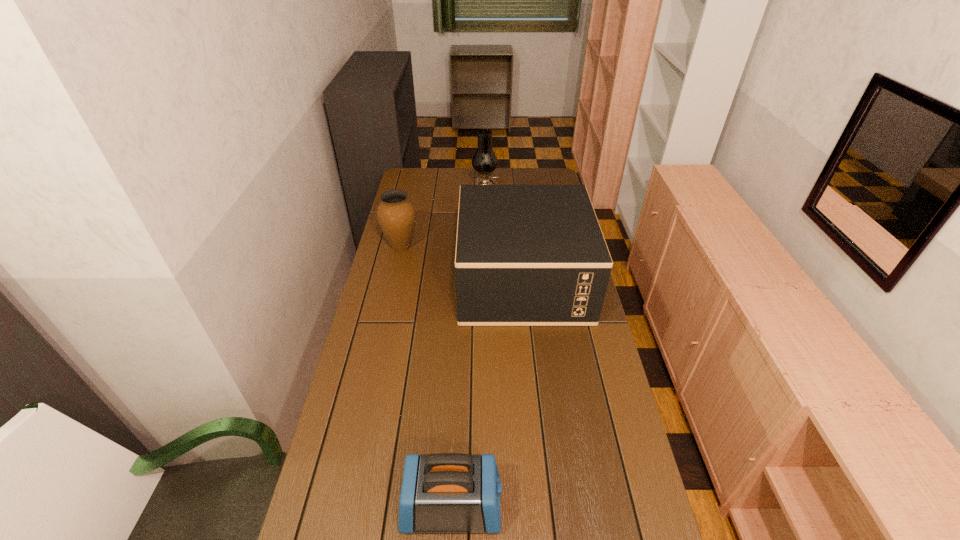
At what (x,y) coordinates should I click in order to perform the action: click on blank space located on the front-facing side of the nearest object. Please return your answer as a coordinate pair (x, y). Image resolution: width=960 pixels, height=540 pixels. Looking at the image, I should click on (599, 506).

At what (x,y) coordinates should I click in order to perform the action: click on object that is positioned at the far edge. Please return your answer as a coordinate pair (x, y). The image size is (960, 540). Looking at the image, I should click on (484, 161).

Image resolution: width=960 pixels, height=540 pixels. I want to click on object positioned at the left edge, so click(x=396, y=215).

Find the location of a particular element. object that is at the right edge is located at coordinates [x=526, y=255].

The width and height of the screenshot is (960, 540). In the image, there is a desktop. What are the coordinates of `vacant space at the left edge` in the screenshot? It's located at (415, 195).

Identify the location of vacant region at the right edge of the desktop. This screenshot has width=960, height=540. (595, 405).

In the image, there is a desktop. Where is `vacant space at the far right corner`? The width and height of the screenshot is (960, 540). vacant space at the far right corner is located at coordinates (540, 184).

Where is `vacant point located between the leftmost object and the farthest object`? Image resolution: width=960 pixels, height=540 pixels. vacant point located between the leftmost object and the farthest object is located at coordinates (443, 220).

The image size is (960, 540). Find the location of `free point between the nearest object and the farthest object`. free point between the nearest object and the farthest object is located at coordinates pyautogui.click(x=468, y=350).

Locate an element on the screen. object that is the second closest to the box is located at coordinates (484, 161).